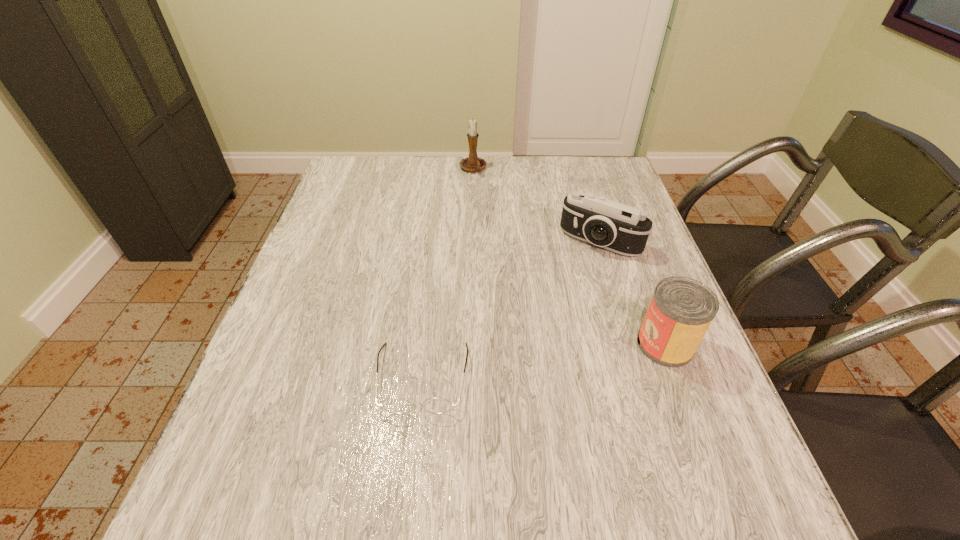
Image resolution: width=960 pixels, height=540 pixels. Identify the location of free space on the desktop that is between the spectacles and the can and is positioned on the side of the candle holder with the handle. (530, 363).

Where is `free space on the desktop that is between the shortest object and the can and is positioned on the front lens of the second farthest object`? Image resolution: width=960 pixels, height=540 pixels. free space on the desktop that is between the shortest object and the can and is positioned on the front lens of the second farthest object is located at coordinates (516, 364).